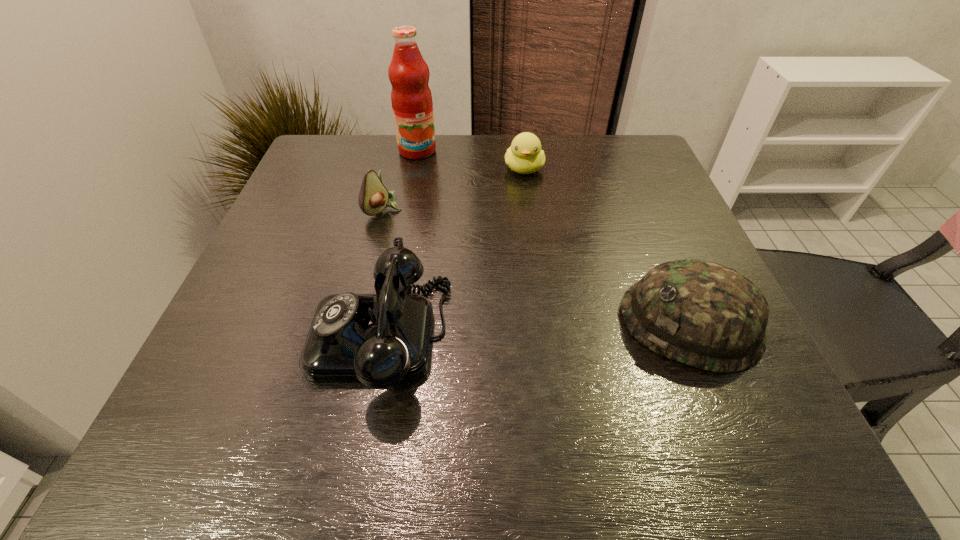
Identify the location of telephone. (380, 339).

Where is `the rightmost object`? The width and height of the screenshot is (960, 540). the rightmost object is located at coordinates (703, 314).

Find the location of a particular element. avocado is located at coordinates (373, 197).

Image resolution: width=960 pixels, height=540 pixels. I want to click on the tallest object, so click(x=411, y=98).

Locate an element on the screen. The height and width of the screenshot is (540, 960). the shortest object is located at coordinates (525, 156).

The image size is (960, 540). What are the coordinates of `the second object from right to left` in the screenshot? It's located at (525, 156).

Locate an element on the screen. Image resolution: width=960 pixels, height=540 pixels. vacant area located on the dial of the telephone is located at coordinates (227, 335).

Image resolution: width=960 pixels, height=540 pixels. In order to click on free space located on the dial of the telephone in this screenshot , I will do `click(215, 335)`.

This screenshot has height=540, width=960. I want to click on vacant space located on the left of the headwear, so pos(555,324).

Identify the location of blank space located on the seed side of the third nearest object. The height and width of the screenshot is (540, 960). (498, 284).